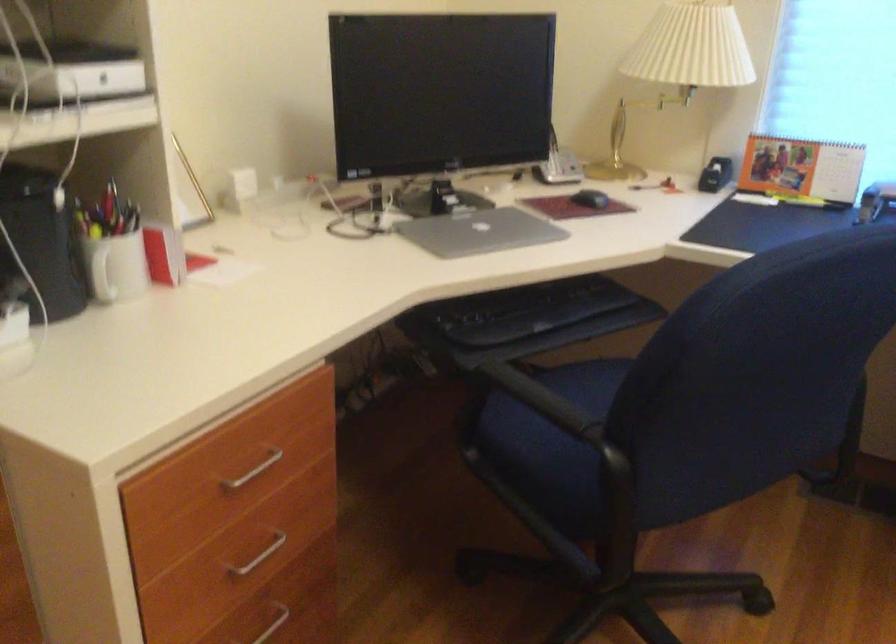
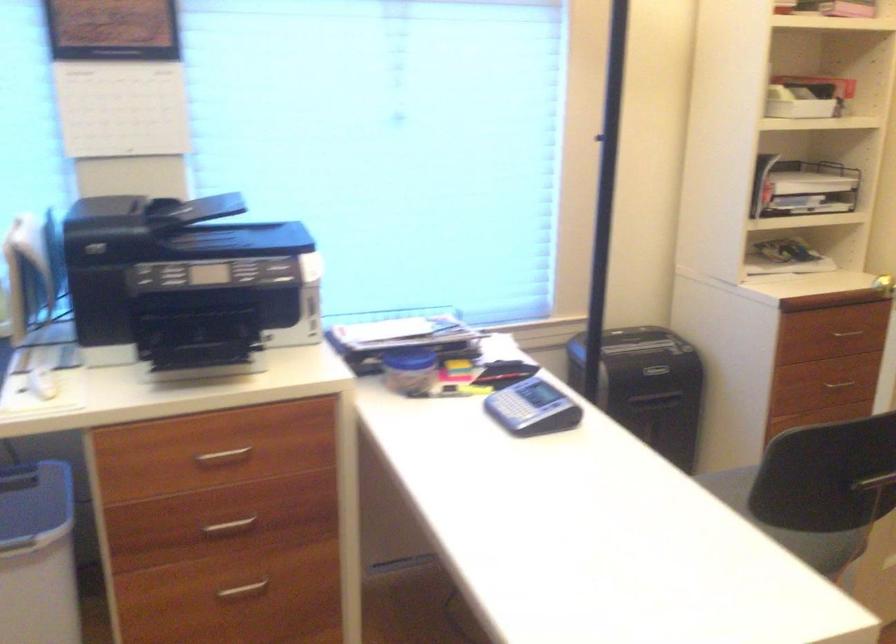
Question: The images are taken continuously from a first-person perspective. In which direction is your viewpoint rotating?

Choices:
 (A) Left
 (B) Right
 (C) Up
 (D) Down

Answer: (B)